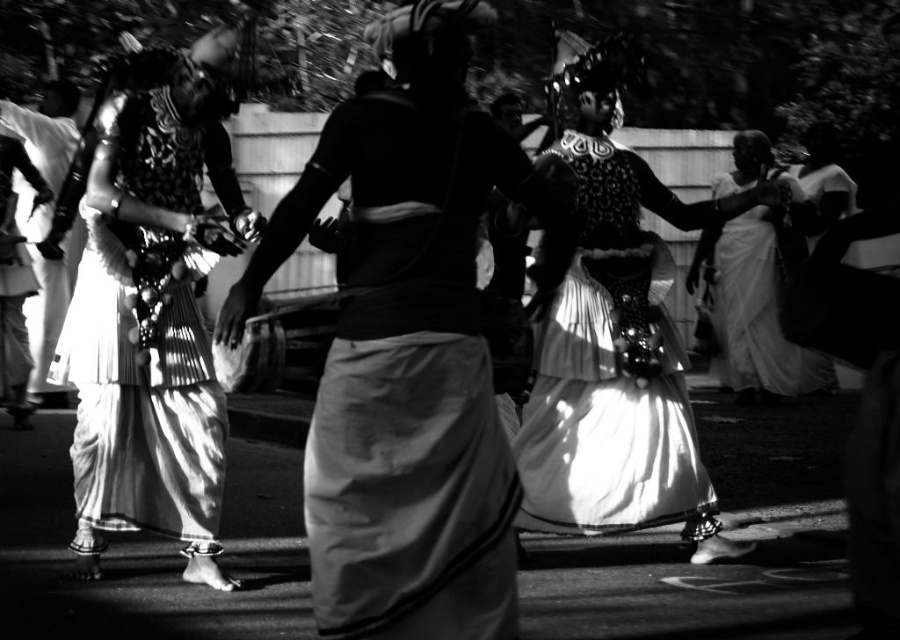
Question: Is shiny white skirt at center thinner than white silk dress at center?

Choices:
 (A) yes
 (B) no

Answer: (B)

Question: Which point is closer to the camera taking this photo?

Choices:
 (A) (726, 289)
 (B) (122, 173)
 (C) (564, 492)

Answer: (B)

Question: Considering the real-world distances, which object is closest to the white sheer fabric dress at left?

Choices:
 (A) white silk dress at center
 (B) shiny white skirt at center

Answer: (B)

Question: Observing the image, what is the correct spatial positioning of white sheer fabric dress at left in reference to shiny white skirt at center?

Choices:
 (A) left
 (B) right

Answer: (A)

Question: Estimate the real-world distances between objects in this image. Which object is closer to the shiny white skirt at center?

Choices:
 (A) white silk dress at center
 (B) white sheer fabric dress at left

Answer: (B)

Question: Considering the relative positions of white sheer fabric dress at left and shiny white skirt at center in the image provided, where is white sheer fabric dress at left located with respect to shiny white skirt at center?

Choices:
 (A) right
 (B) left

Answer: (B)